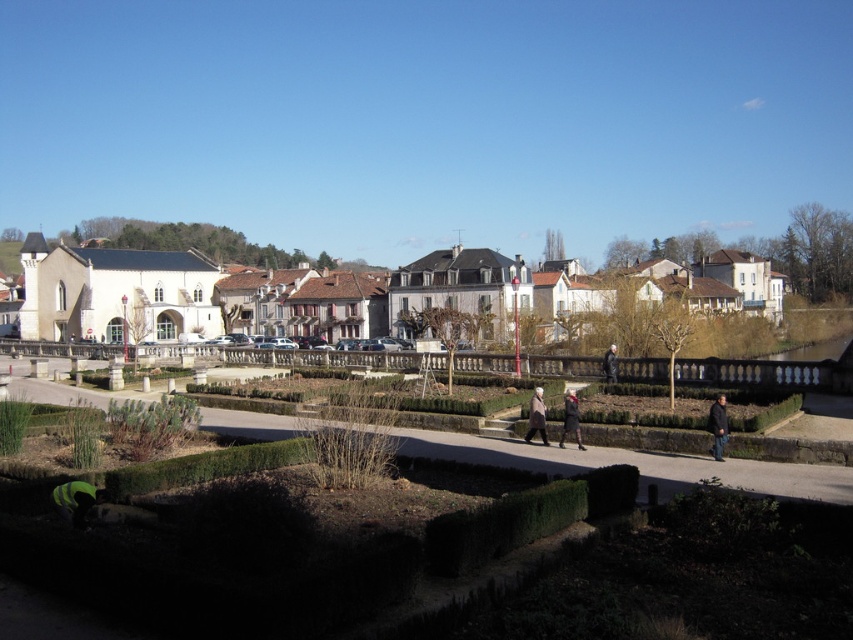
Question: Can you confirm if white stone buildings at center is smaller than dark gray coat at center?

Choices:
 (A) yes
 (B) no

Answer: (B)

Question: Which of the following is the farthest from the observer?

Choices:
 (A) brown wool coat at center
 (B) white stone buildings at center
 (C) black leather jacket at lower right

Answer: (B)

Question: Which point appears farthest from the camera in this image?

Choices:
 (A) (338, 333)
 (B) (541, 412)
 (C) (604, 371)

Answer: (A)

Question: Considering the real-world distances, which object is closest to the dark brown leather coat at center?

Choices:
 (A) white stone buildings at center
 (B) brown wool coat at center

Answer: (B)

Question: Is green grass at center thinner than dark gray coat at center?

Choices:
 (A) no
 (B) yes

Answer: (A)

Question: Is black leather jacket at lower right below dark brown leather coat at center?

Choices:
 (A) no
 (B) yes

Answer: (A)